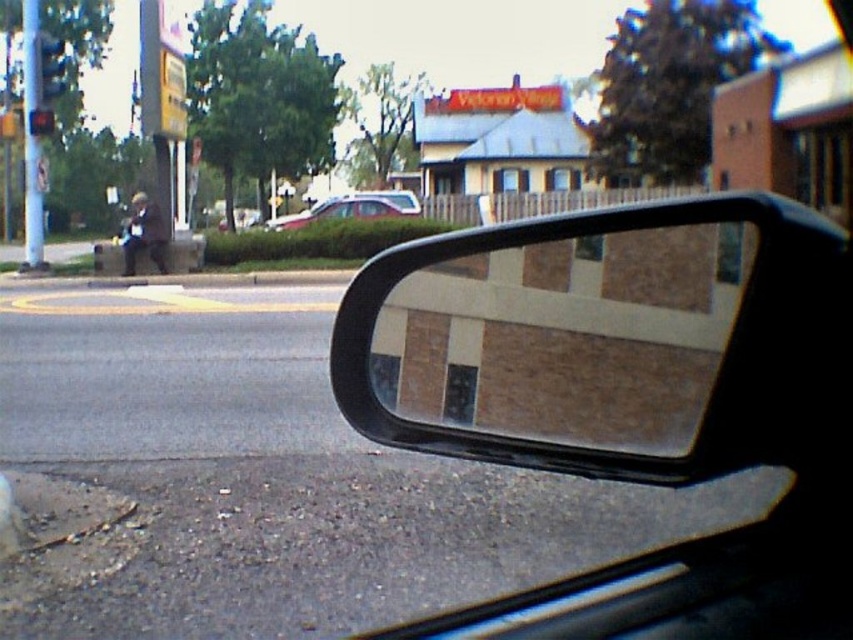
What do you see at coordinates (566, 337) in the screenshot? This screenshot has width=853, height=640. I see `matte brown mirror at right` at bounding box center [566, 337].

Between matte brown mirror at right and silver metallic sedan at center, which one appears on the right side from the viewer's perspective?

From the viewer's perspective, matte brown mirror at right appears more on the right side.

Between point (413, 368) and point (384, 205), which one is positioned behind?

Positioned behind is point (384, 205).

This screenshot has width=853, height=640. I want to click on matte brown mirror at right, so click(x=566, y=337).

Between matte brown mirror at right and metallic blue traffic light at upper left, which one is positioned higher?

metallic blue traffic light at upper left is above.

Is the position of matte brown mirror at right less distant than that of metallic blue traffic light at upper left?

Yes, it is.

Is point (543, 435) closer to viewer compared to point (42, 38)?

That is True.

Find the location of `matte brown mirror at right`. matte brown mirror at right is located at coordinates (566, 337).

Looking at this image, how far apart are metallic blue traffic light at upper left and metallic traffic light at upper left?

The distance of metallic blue traffic light at upper left from metallic traffic light at upper left is 38.09 inches.

Between metallic blue traffic light at upper left and metallic traffic light at upper left, which one is positioned higher?

metallic blue traffic light at upper left is above.

Which is behind, point (48, 92) or point (48, 128)?

The point (48, 92) is more distant.

Locate an element on the screen. metallic blue traffic light at upper left is located at coordinates (48, 68).